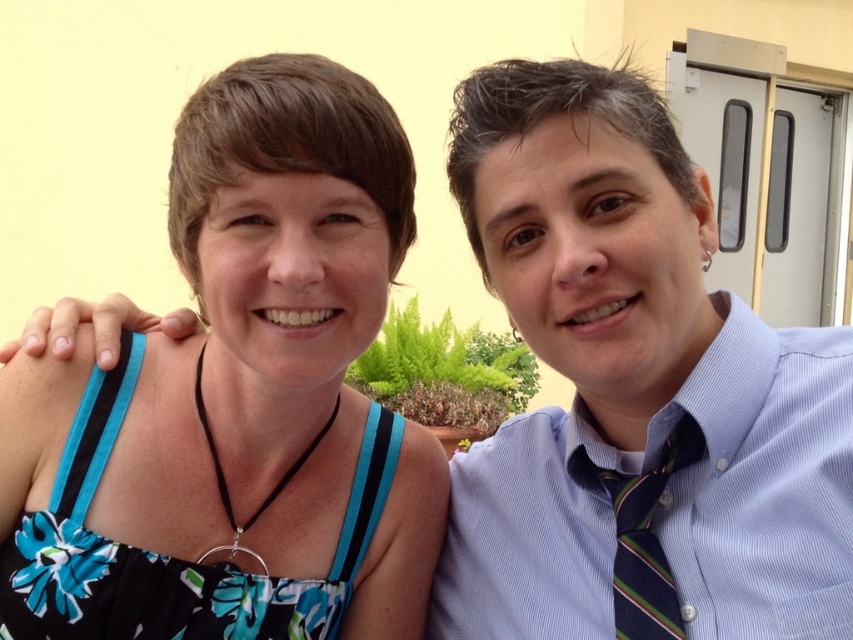
You are trying to decide which dress to wear for an event. You have a blue floral dress at left and a black floral fabric dress at left. Which dress has a wider silhouette?

The blue floral dress at left is wider than the black floral fabric dress at left according to the description.

From the picture: You are a photographer setting up for a portrait. You need to ensure that the black floral fabric dress at left and the striped fabric tie at right are both visible in the frame. Based on their positions, which object is closer to the left edge of the photo?

The black floral fabric dress at left is closer to the left edge of the photo since it is positioned to the left of the striped fabric tie at right.

You are taking a photo of two people standing side by side. You notice the blue floral dress at left and the striped fabric tie at right. Which clothing item is positioned higher in the image?

The blue floral dress at left is located above the striped fabric tie at right, so it is positioned higher in the image.